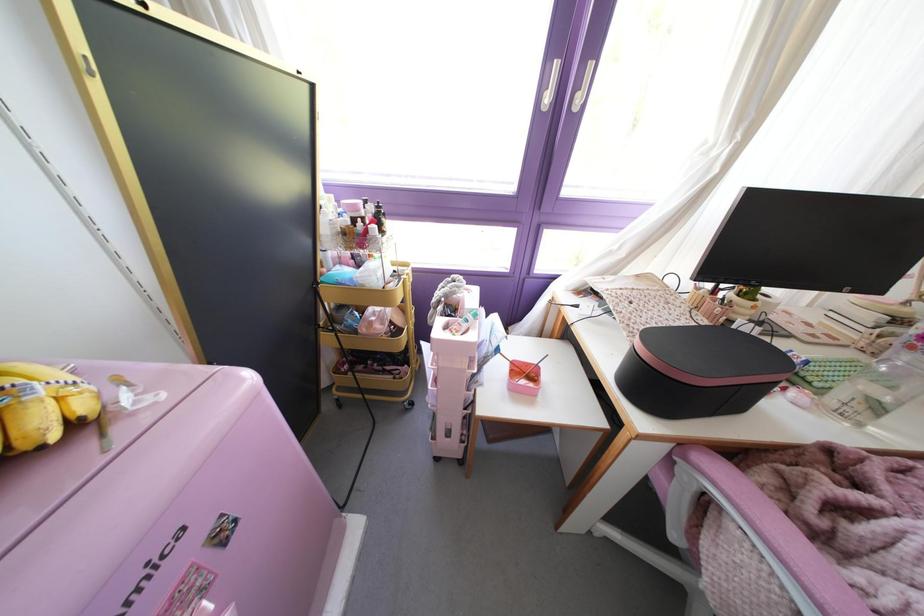
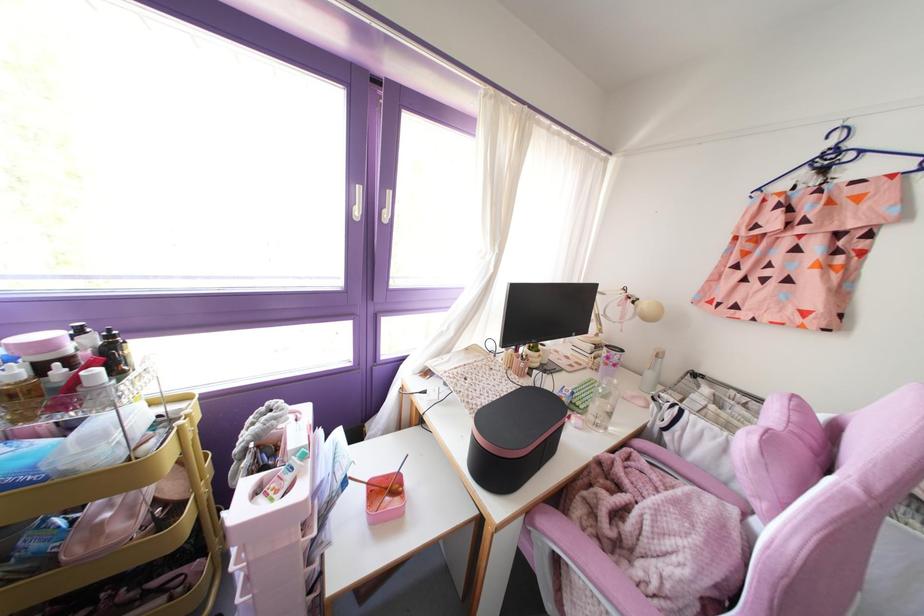
Question: The camera is either moving clockwise (left) or counter-clockwise (right) around the object. The first image is from the beginning of the video and the second image is from the end. Is the camera moving left or right when shooting the video?

Choices:
 (A) Left
 (B) Right

Answer: (A)